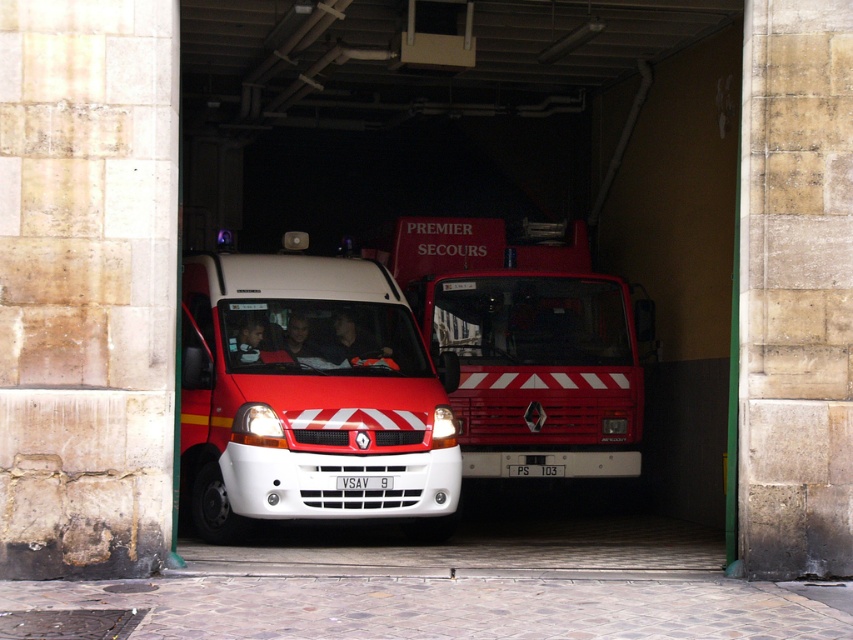
You are a firefighter who needs to quickly access the red matte fire truck at center. You are currently standing next to the white matte van at center. Can you walk directly to the fire truck without needing to move any other vehicles? Explain your reasoning.

The white matte van at center and red matte fire truck at center are 2.41 meters apart. Since the distance between them is only 2.41 meters, you can easily walk directly to the fire truck without needing to move any other vehicles as there is enough space between them for a person to walk through.

You are a fireman who needs to move the white matte van at center to make space for an incoming emergency vehicle. The incoming vehicle requires a minimum clearance of 10 meters between the van and the larger red vehicle labeled PREMIER SECOURS. Is the current distance sufficient?

The white matte van at center and the larger red vehicle labeled PREMIER SECOURS are 10.76 meters apart, which exceeds the required 10 meters clearance. Therefore, the current distance is sufficient.

You are a firefighter trying to exit the garage through a door on the right side. Which vehicle should you move first, the white matte van at center or the red matte fire truck at center, to clear the path?

The white matte van at center is to the left of the red matte fire truck at center, so you should move the red matte fire truck at center first to allow the white matte van at center to move out of the way and clear the path to the right door.